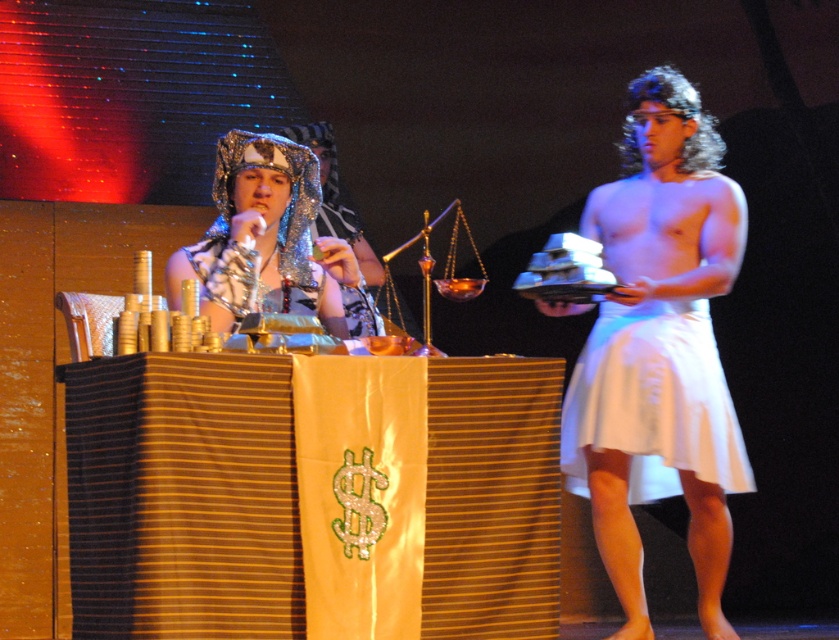
Does white clothed person at right have a larger size compared to shiny silver headscarf at center?

Yes.

Between point (736, 209) and point (216, 316), which one is positioned behind?

The point (736, 209) is behind.

Locate an element on the screen. The width and height of the screenshot is (839, 640). white clothed person at right is located at coordinates (659, 349).

Is white cotton skirt at center shorter than shiny silver headscarf at center?

No, white cotton skirt at center is not shorter than shiny silver headscarf at center.

Can you confirm if white cotton skirt at center is taller than shiny silver headscarf at center?

Indeed, white cotton skirt at center has a greater height compared to shiny silver headscarf at center.

Consider the image. Measure the distance between point (675, 381) and camera.

5.61 meters

This screenshot has height=640, width=839. I want to click on white cotton skirt at center, so click(653, 401).

I want to click on white clothed person at right, so click(x=659, y=349).

Is white clothed person at right shorter than white cotton skirt at center?

Incorrect, white clothed person at right's height does not fall short of white cotton skirt at center's.

Measure the distance between white clothed person at right and camera.

The distance of white clothed person at right from camera is 5.45 meters.

Identify the location of white clothed person at right. Image resolution: width=839 pixels, height=640 pixels. click(x=659, y=349).